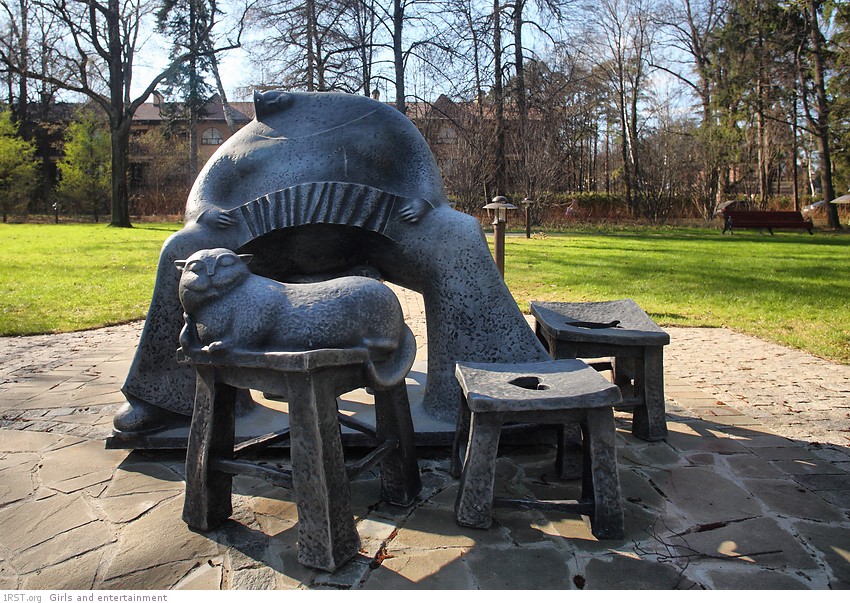
Identify the location of stool. The height and width of the screenshot is (603, 850). (324, 511).